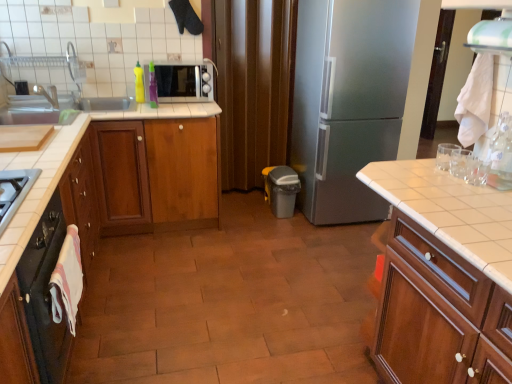
At what (x,y) coordinates should I click in order to perform the action: click on free point below white glossy microwave at upper center (from a real-world perspective). Please return your answer as a coordinate pair (x, y). Image resolution: width=512 pixels, height=384 pixels. Looking at the image, I should click on (180, 99).